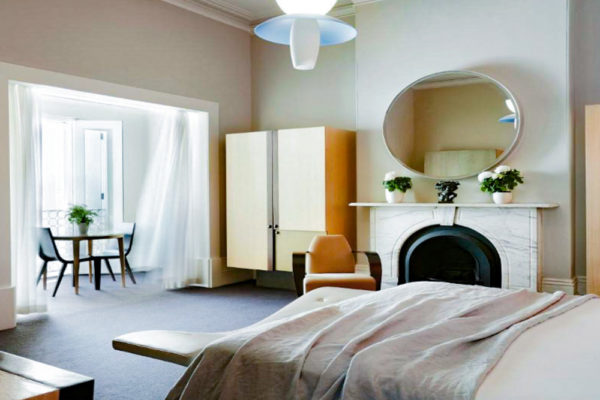
Locate an element on the screen. mirror is located at coordinates tap(441, 136).